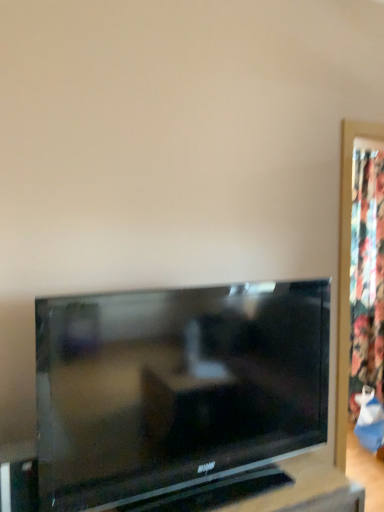
Question: Could you tell me if floral fabric curtain at right is turned towards matte black tv at center?

Choices:
 (A) no
 (B) yes

Answer: (A)

Question: From the image's perspective, would you say floral fabric curtain at right is shown under matte black tv at center?

Choices:
 (A) no
 (B) yes

Answer: (A)

Question: Is floral fabric curtain at right facing away from matte black tv at center?

Choices:
 (A) yes
 (B) no

Answer: (B)

Question: Can matte black tv at center be found inside floral fabric curtain at right?

Choices:
 (A) yes
 (B) no

Answer: (B)

Question: Can you confirm if floral fabric curtain at right is wider than matte black tv at center?

Choices:
 (A) no
 (B) yes

Answer: (B)

Question: From a real-world perspective, is floral fabric curtain at right located higher than matte black tv at center?

Choices:
 (A) no
 (B) yes

Answer: (B)

Question: From the image's perspective, would you say matte black tv at center is positioned over floral fabric curtain at right?

Choices:
 (A) no
 (B) yes

Answer: (A)

Question: From a real-world perspective, does matte black tv at center stand above floral fabric curtain at right?

Choices:
 (A) no
 (B) yes

Answer: (A)

Question: Would you say matte black tv at center contains floral fabric curtain at right?

Choices:
 (A) no
 (B) yes

Answer: (A)

Question: From the image's perspective, is matte black tv at center located beneath floral fabric curtain at right?

Choices:
 (A) yes
 (B) no

Answer: (A)

Question: Considering the relative positions of matte black tv at center and floral fabric curtain at right in the image provided, is matte black tv at center to the right of floral fabric curtain at right from the viewer's perspective?

Choices:
 (A) no
 (B) yes

Answer: (A)

Question: Can you confirm if matte black tv at center is thinner than floral fabric curtain at right?

Choices:
 (A) yes
 (B) no

Answer: (A)

Question: Would you say matte black tv at center is to the left or to the right of floral fabric curtain at right in the picture?

Choices:
 (A) left
 (B) right

Answer: (A)